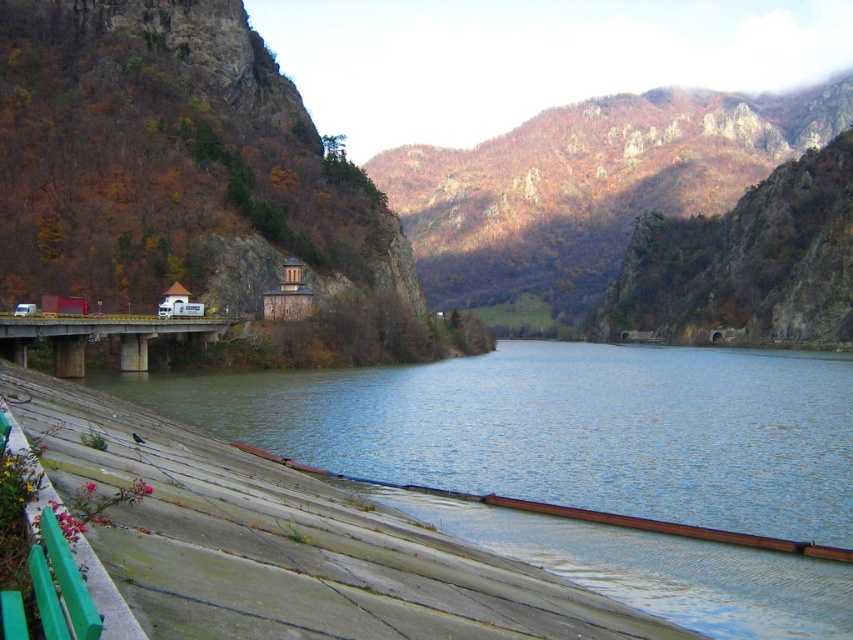
Question: Where is blue concrete river at lower left located in relation to brown rocky mountain at center in the image?

Choices:
 (A) right
 (B) left

Answer: (B)

Question: Which object is farther from the camera taking this photo?

Choices:
 (A) brown rocky mountain at upper center
 (B) concrete bridge at center
 (C) brown rocky mountain at center

Answer: (A)

Question: Is blue concrete river at lower left behind brown rocky mountain at upper center?

Choices:
 (A) yes
 (B) no

Answer: (B)

Question: Is blue concrete river at lower left positioned before concrete bridge at center?

Choices:
 (A) yes
 (B) no

Answer: (A)

Question: Which object is the farthest from the blue concrete river at lower left?

Choices:
 (A) brown rocky mountain at upper center
 (B) brown rocky mountain at center
 (C) concrete bridge at center

Answer: (A)

Question: Which point is farther to the camera?

Choices:
 (A) (131, 209)
 (B) (370, 456)
 (C) (685, 182)
 (D) (62, 342)

Answer: (C)